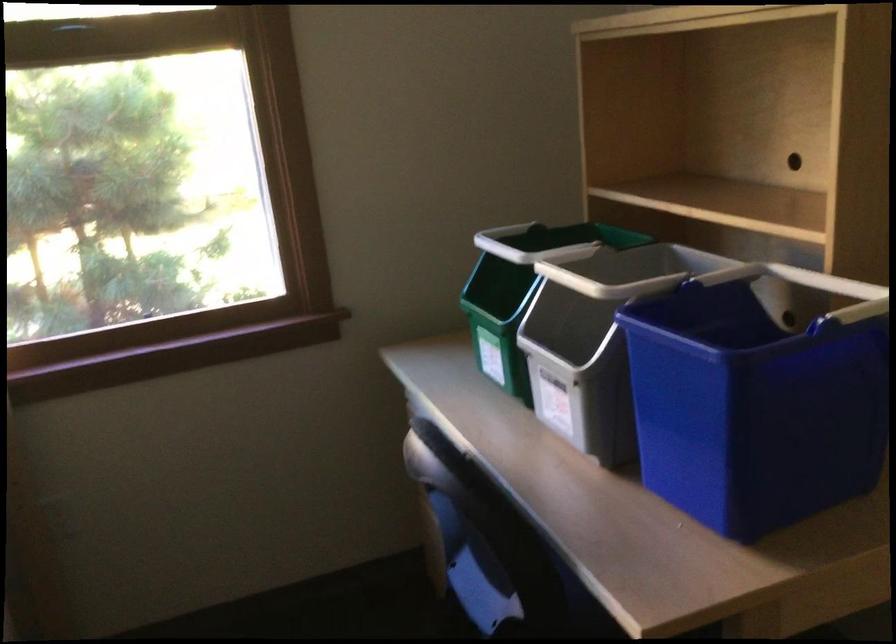
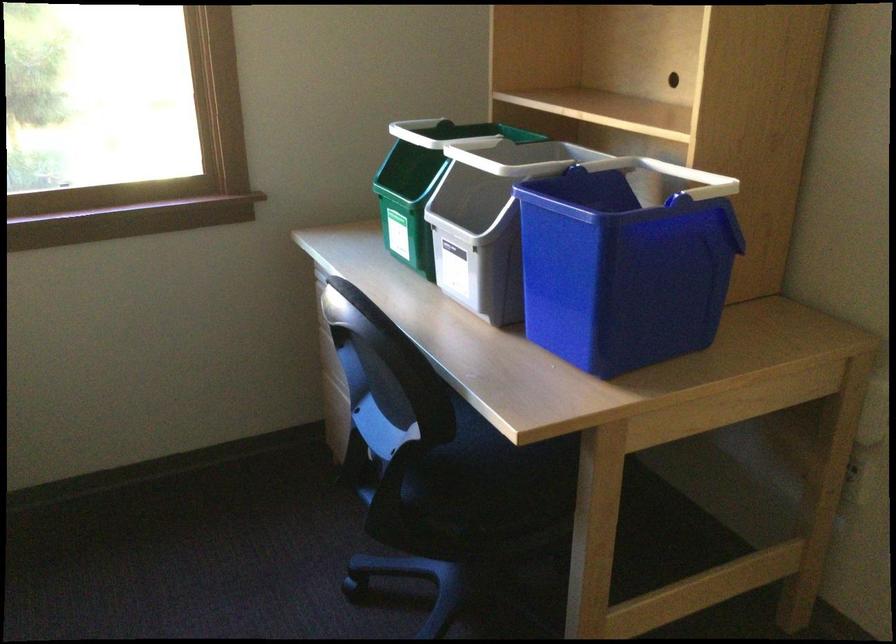
In the second image, find the point that corresponds to (x=581, y=317) in the first image.

(479, 201)